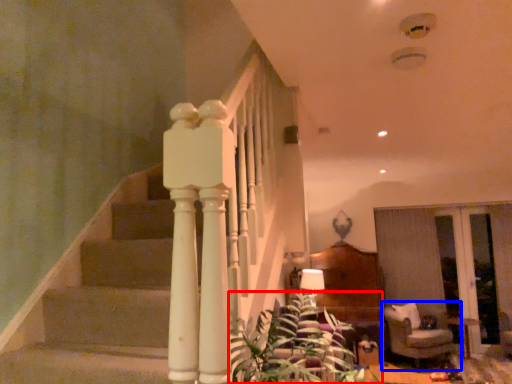
Question: Which object is further to the camera taking this photo, plant (highlighted by a red box) or furniture (highlighted by a blue box)?

Choices:
 (A) plant
 (B) furniture

Answer: (B)